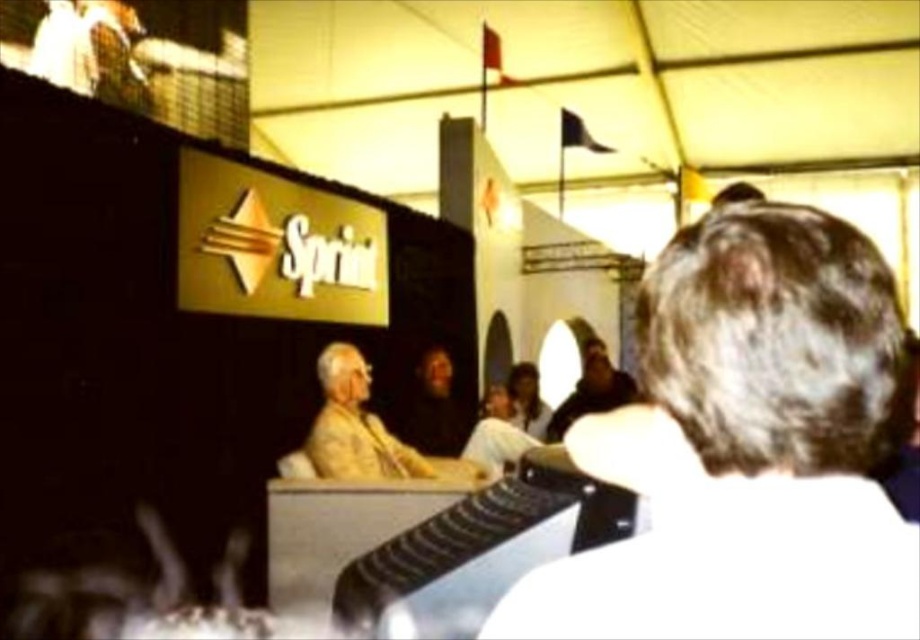
You are a photographer at the event and want to capture a photo that includes both the white matte hair at upper right and the yellow fabric at center. Which object should you focus on first to ensure both are in frame?

You should focus on the yellow fabric at center first because it occupies more space than the white matte hair at upper right, ensuring it fits properly in the frame.